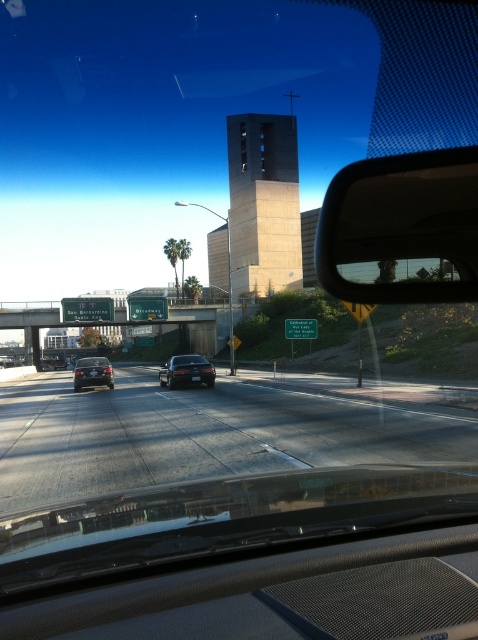
You are a passenger in the car and looking at the scene through the windshield. Where exactly is the satin black sedan at center located in terms of coordinates?

The satin black sedan at center is located at coordinates point (x=186, y=371).

You are sitting in the car and looking out the windshield. There is a satin black sedan at center. Where is the satin black sedan at center located in relation to the point marked at coordinates (186, 371)?

The satin black sedan at center is located at point (186, 371).